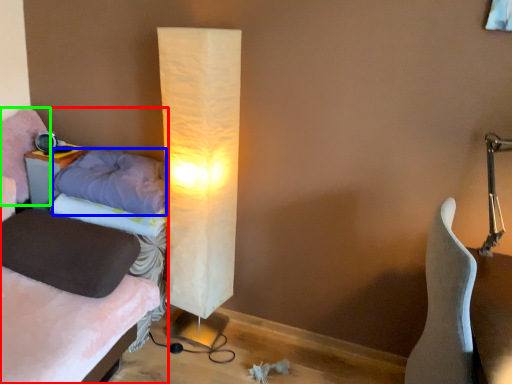
Question: Estimate the real-world distances between objects in this image. Which object is closer to bed (highlighted by a red box), pillow (highlighted by a blue box) or pillow (highlighted by a green box)?

Choices:
 (A) pillow
 (B) pillow

Answer: (A)